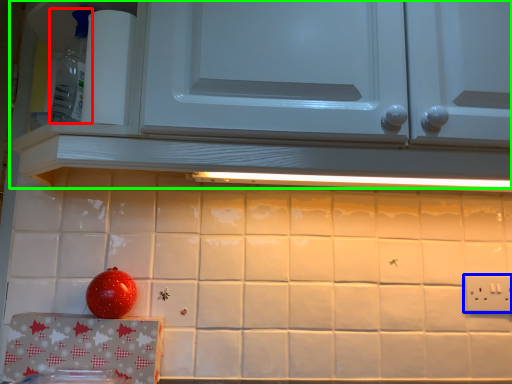
Question: Estimate the real-world distances between objects in this image. Which object is farther from appliance (highlighted by a red box), electric outlet (highlighted by a blue box) or cabinetry (highlighted by a green box)?

Choices:
 (A) electric outlet
 (B) cabinetry

Answer: (A)